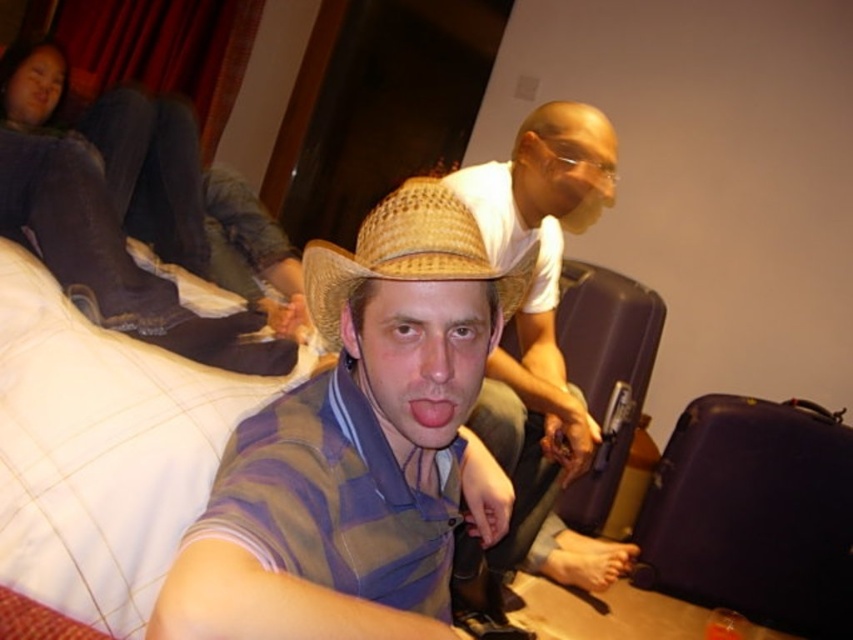
Question: Which point is closer to the camera taking this photo?

Choices:
 (A) (381, 449)
 (B) (566, 332)
 (C) (575, 445)

Answer: (A)

Question: Can you confirm if straw hat at center is smaller than strawhat at center?

Choices:
 (A) yes
 (B) no

Answer: (B)

Question: Is matte straw hat at center to the left of pink glossy lips at center from the viewer's perspective?

Choices:
 (A) no
 (B) yes

Answer: (A)

Question: Does straw hat at center come behind matte straw hat at center?

Choices:
 (A) yes
 (B) no

Answer: (B)

Question: Which of the following is the closest to the observer?

Choices:
 (A) purple matte suitcase at lower right
 (B) purple matte suitcase at center
 (C) strawhat at center

Answer: (C)

Question: Which object is the closest to the strawhat at center?

Choices:
 (A) purple matte suitcase at lower right
 (B) purple matte suitcase at center

Answer: (B)